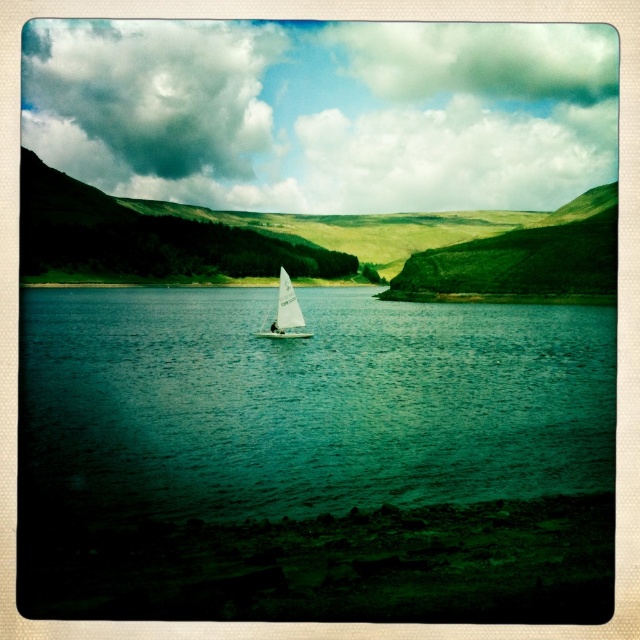
You are standing at the point with coordinates point (308, 403) in the lakeside scene. What can you see around you?

You are standing in the green water at center, as indicated by the coordinates point (308, 403).

You are a photographer planning to capture the green water at center in the image. Based on its coordinates, where exactly should you position your camera to ensure it is centered in your shot?

To center the green water at center in your shot, position your camera at the coordinates specified in the scene description, which are point 0.630 on the x axis and 0.484 on the y axis.